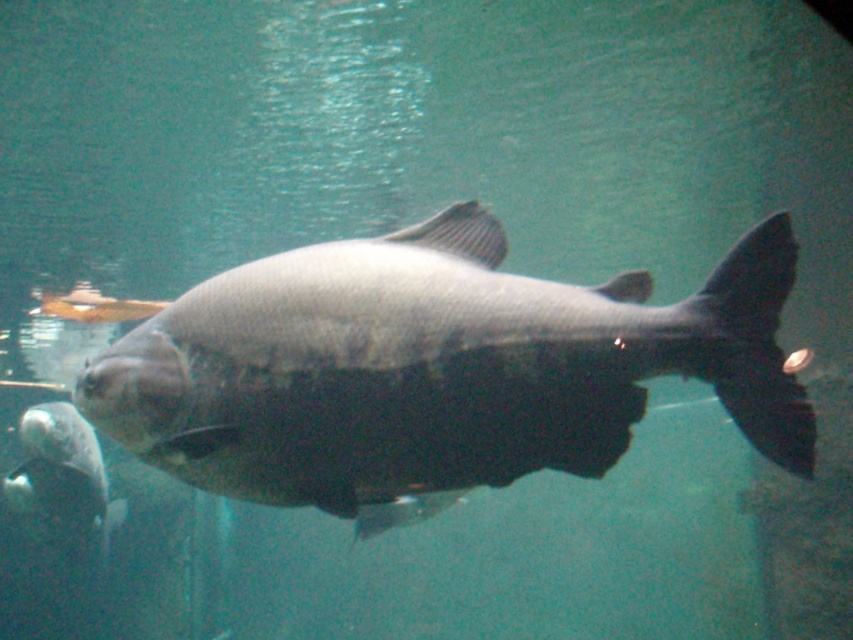
Question: In this image, where is shiny silver fish at center located relative to shiny silver fish at lower left?

Choices:
 (A) below
 (B) above

Answer: (B)

Question: Which object appears closest to the camera in this image?

Choices:
 (A) shiny silver fish at center
 (B) shiny silver fish at lower left

Answer: (A)

Question: Is shiny silver fish at center positioned in front of shiny silver fish at lower left?

Choices:
 (A) no
 (B) yes

Answer: (B)

Question: Which point is closer to the camera taking this photo?

Choices:
 (A) (222, 342)
 (B) (48, 500)

Answer: (A)

Question: Observing the image, what is the correct spatial positioning of shiny silver fish at center in reference to shiny silver fish at lower left?

Choices:
 (A) above
 (B) below

Answer: (A)

Question: Among these objects, which one is farthest from the camera?

Choices:
 (A) shiny silver fish at lower left
 (B) shiny silver fish at center

Answer: (A)